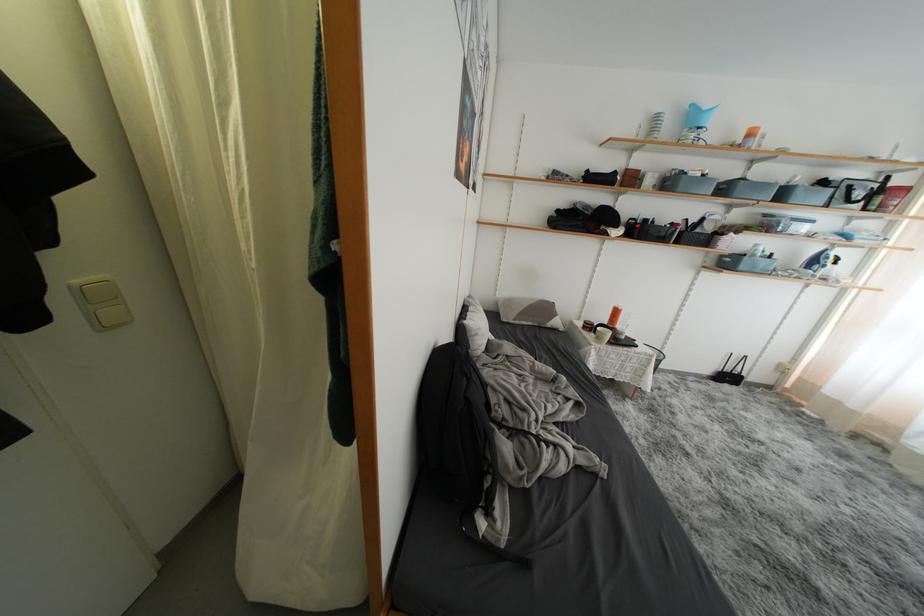
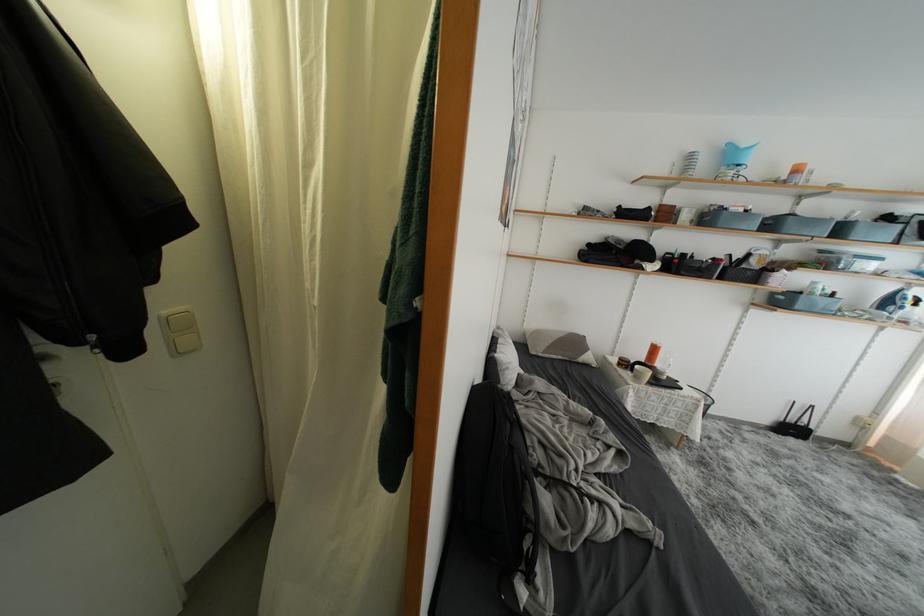
In the second image, find the point that corresponds to (x=732, y=193) in the first image.

(777, 229)